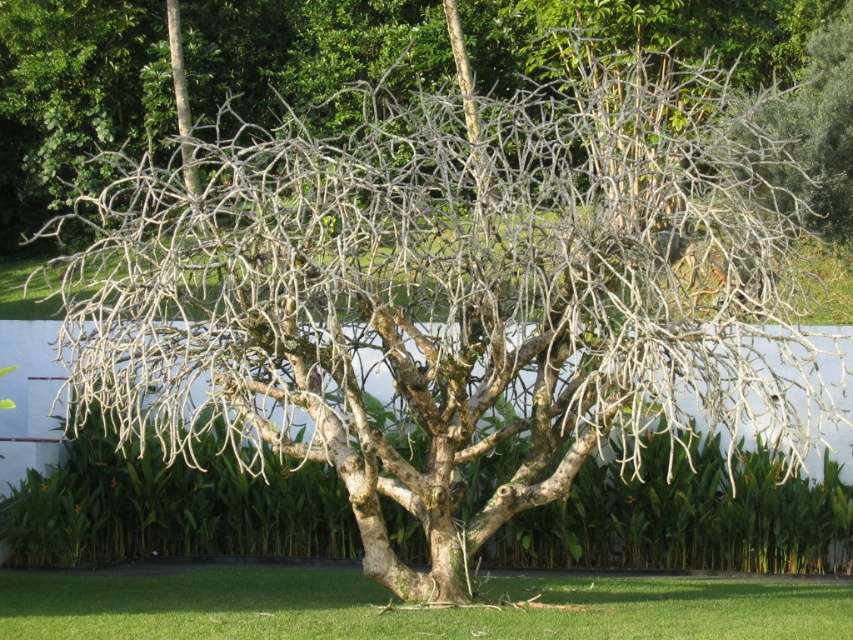
Which is behind, point (218, 77) or point (627, 589)?

The point (218, 77) is more distant.

Which is more to the right, bare branches at center or green grass at lower center?

green grass at lower center is more to the right.

Between point (33, 120) and point (289, 577), which one is positioned behind?

The point (33, 120) is more distant.

What are the coordinates of `bare branches at center` in the screenshot? It's located at (73, 97).